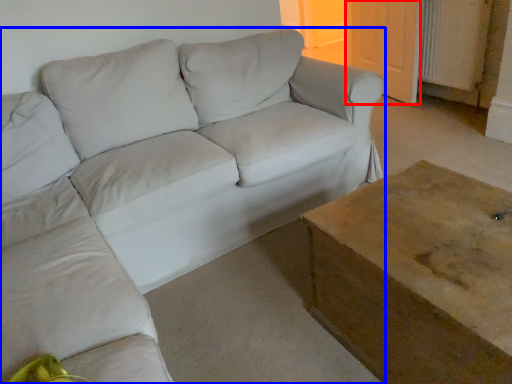
Question: Which object is closer to the camera taking this photo, door (highlighted by a red box) or studio couch (highlighted by a blue box)?

Choices:
 (A) door
 (B) studio couch

Answer: (B)